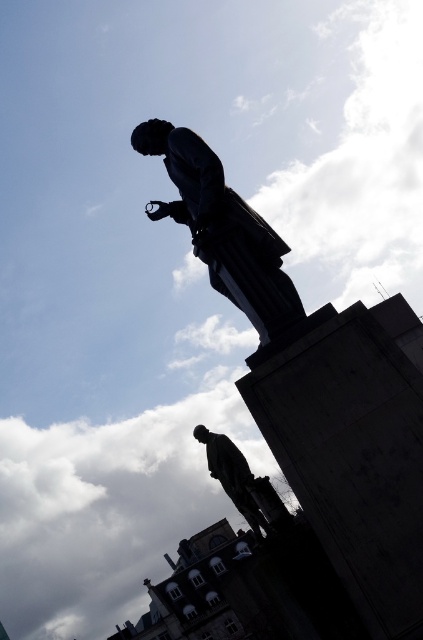
Question: In this image, where is polished bronze statue at upper center located relative to polished bronze statue at center?

Choices:
 (A) above
 (B) below

Answer: (A)

Question: Which point appears farthest from the camera in this image?

Choices:
 (A) (145, 154)
 (B) (230, 445)

Answer: (B)

Question: Which point is closer to the camera?

Choices:
 (A) (261, 528)
 (B) (214, 180)

Answer: (B)

Question: Considering the relative positions of polished bronze statue at upper center and polished bronze statue at center in the image provided, where is polished bronze statue at upper center located with respect to polished bronze statue at center?

Choices:
 (A) above
 (B) below

Answer: (A)

Question: Is polished bronze statue at upper center to the left of polished bronze statue at center from the viewer's perspective?

Choices:
 (A) no
 (B) yes

Answer: (A)

Question: Which point appears closest to the camera in this image?

Choices:
 (A) (225, 440)
 (B) (275, 285)

Answer: (B)